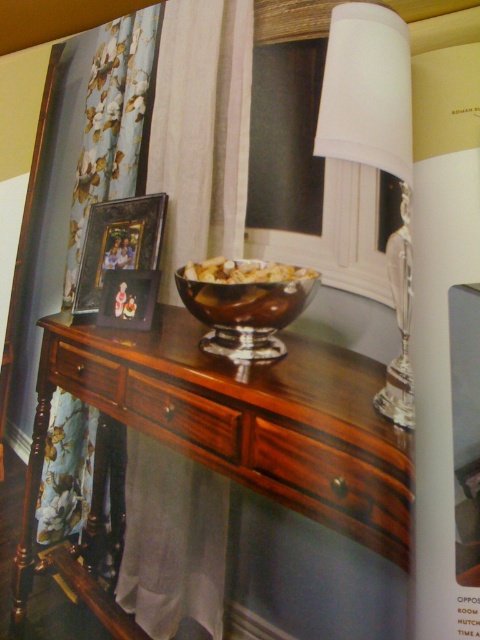
Question: Which object is farther from the camera taking this photo?

Choices:
 (A) shiny brown glass bowl at center
 (B) floral fabric curtain at left

Answer: (B)

Question: Is mahogany wood drawer at center to the left of shiny brown bowl at center from the viewer's perspective?

Choices:
 (A) no
 (B) yes

Answer: (B)

Question: Is shiny brown glass bowl at center positioned in front of shiny brown bowl at center?

Choices:
 (A) no
 (B) yes

Answer: (B)

Question: Which point is farther to the camera?

Choices:
 (A) (218, 344)
 (B) (313, 452)

Answer: (A)

Question: Among these objects, which one is farthest from the camera?

Choices:
 (A) floral fabric curtain at left
 (B) shiny brown glass bowl at center
 (C) brown wood drawer at center
 (D) mahogany wood drawer at center

Answer: (A)

Question: Does white paper lampshade at right have a greater width compared to shiny brown bowl at center?

Choices:
 (A) yes
 (B) no

Answer: (B)